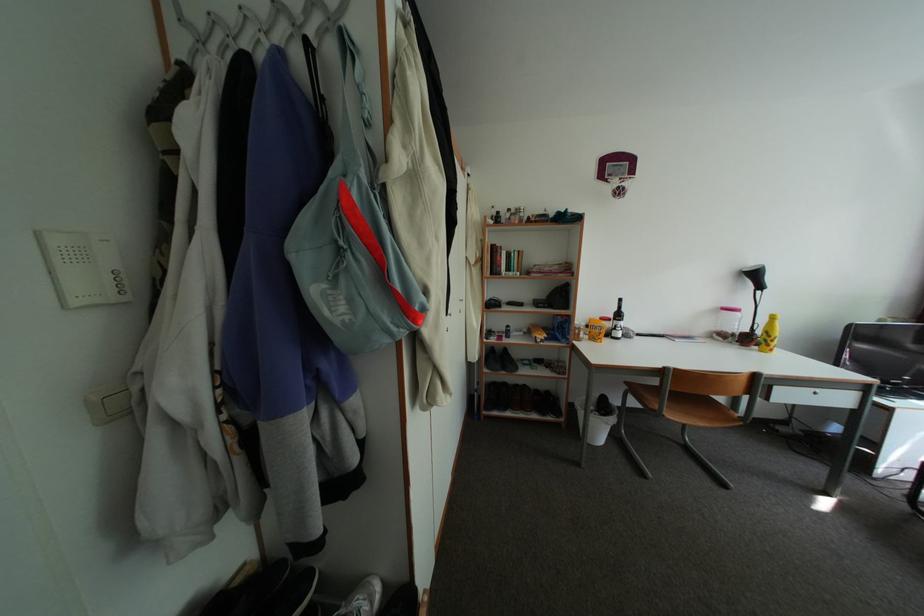
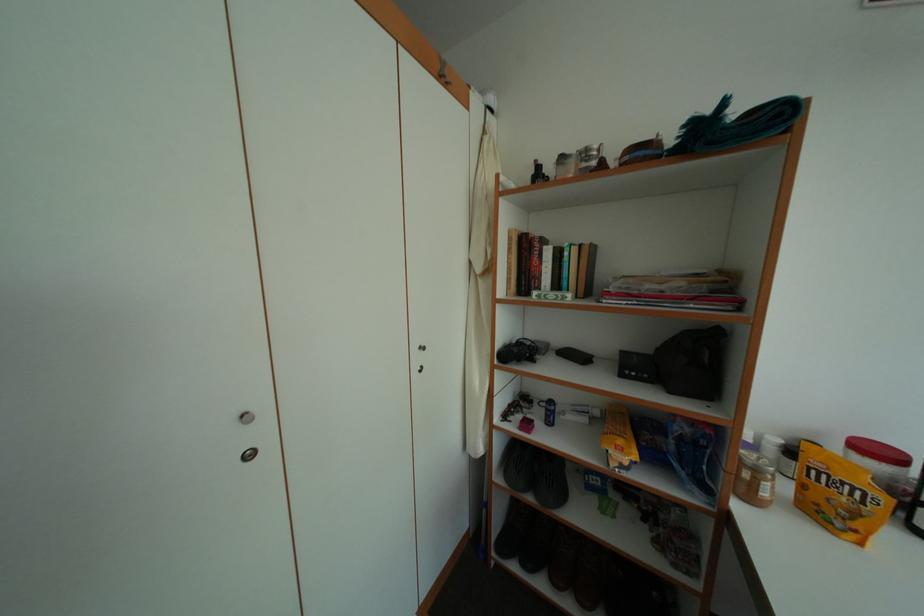
In a continuous first-person perspective shot, in which direction is the camera moving?

The cameraman walked toward right, forward.